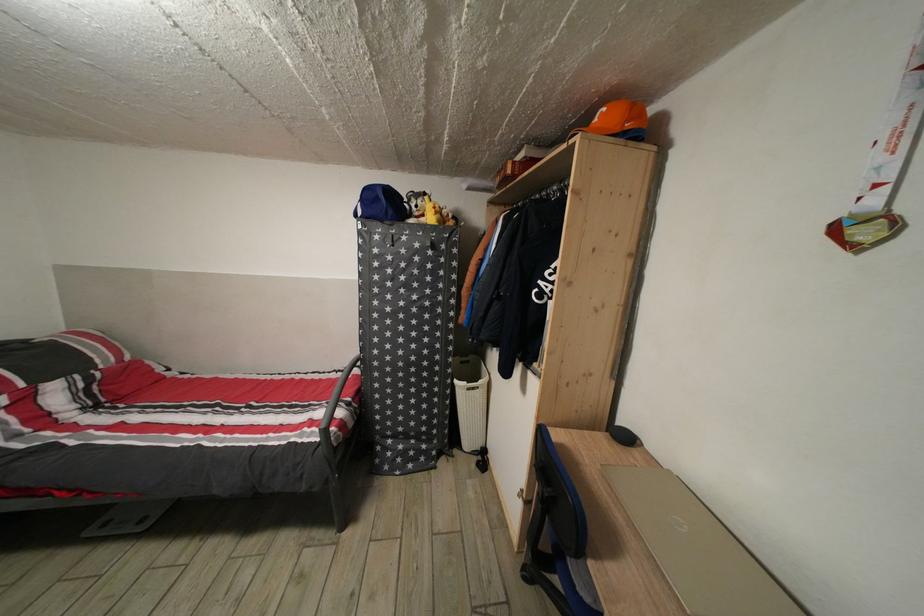
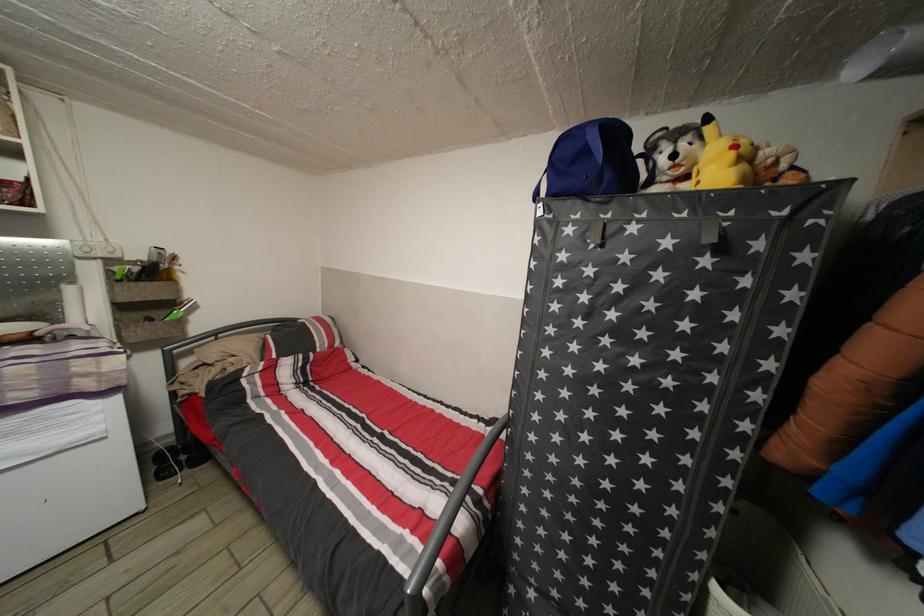
In the second image, find the point that corresponds to (383,244) in the first image.

(576, 237)